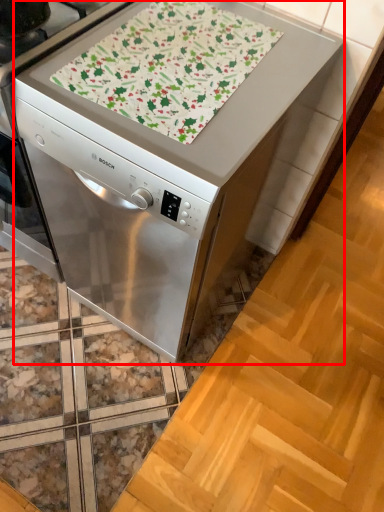
Question: From the image's perspective, where is home appliance (annotated by the red box) located relative to blanket?

Choices:
 (A) below
 (B) above

Answer: (A)